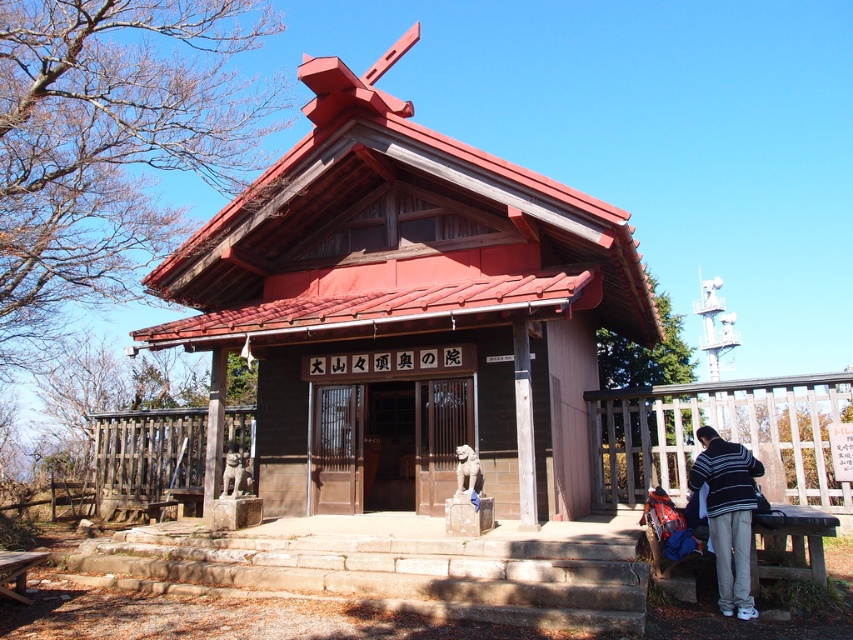
Question: Which of the following is the farthest from the observer?

Choices:
 (A) (699, 454)
 (B) (21, 593)
 (C) (558, 467)

Answer: (C)

Question: Which object is the closest to the striped sweater at lower right?

Choices:
 (A) brown wooden picnic table at lower left
 (B) wooden temple at center

Answer: (A)

Question: Can you confirm if wooden temple at center is positioned above striped sweater at lower right?

Choices:
 (A) yes
 (B) no

Answer: (A)

Question: Can you confirm if striped sweater at lower right is bigger than brown wooden picnic table at lower left?

Choices:
 (A) no
 (B) yes

Answer: (B)

Question: Among these objects, which one is nearest to the camera?

Choices:
 (A) striped sweater at lower right
 (B) wooden temple at center

Answer: (A)

Question: Does wooden temple at center appear on the left side of brown wooden picnic table at lower left?

Choices:
 (A) no
 (B) yes

Answer: (A)